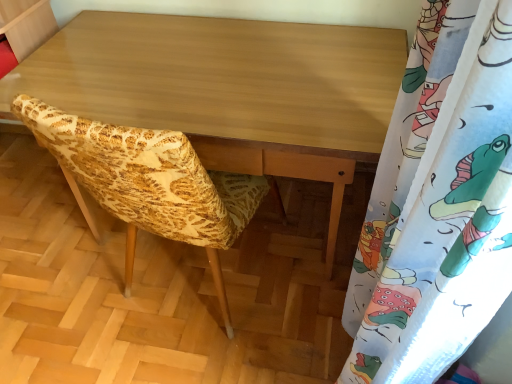
The image size is (512, 384). I want to click on white fabric with colorful cartoon print at right, so click(x=438, y=202).

Is light brown wood desk at center inside the boundaries of yellow fabric chair at center, or outside?

light brown wood desk at center is not inside yellow fabric chair at center, it's outside.

Is point (55, 58) closer to viewer compared to point (153, 148)?

That is False.

Which of these two, light brown wood desk at center or yellow fabric chair at center, is smaller?

With smaller size is yellow fabric chair at center.

Considering their positions, is light brown wood desk at center located in front of or behind yellow fabric chair at center?

light brown wood desk at center is in front of yellow fabric chair at center.

Is white fabric with colorful cartoon print at right taller than yellow fabric chair at center?

Correct, white fabric with colorful cartoon print at right is much taller as yellow fabric chair at center.

Looking at this image, from a real-world perspective, between white fabric with colorful cartoon print at right and yellow fabric chair at center, who is vertically lower?

From a 3D spatial view, yellow fabric chair at center is below.

Is white fabric with colorful cartoon print at right aimed at yellow fabric chair at center?

Yes.

Is yellow fabric chair at center located within white fabric with colorful cartoon print at right?

No, yellow fabric chair at center is not surrounded by white fabric with colorful cartoon print at right.

Which of these two, yellow fabric chair at center or light brown wood desk at center, stands shorter?

yellow fabric chair at center.

Consider the image. From a real-world perspective, which object rests below the other?

From a 3D spatial view, yellow fabric chair at center is below.

Does point (70, 167) appear closer or farther from the camera than point (312, 139)?

Point (70, 167) is positioned farther from the camera compared to point (312, 139).

Considering the relative positions of yellow fabric chair at center and white fabric with colorful cartoon print at right in the image provided, is yellow fabric chair at center behind white fabric with colorful cartoon print at right?

Yes, it is behind white fabric with colorful cartoon print at right.

Measure the distance from yellow fabric chair at center to white fabric with colorful cartoon print at right.

yellow fabric chair at center and white fabric with colorful cartoon print at right are 18.23 inches apart.

Do you think yellow fabric chair at center is within white fabric with colorful cartoon print at right, or outside of it?

yellow fabric chair at center exists outside the volume of white fabric with colorful cartoon print at right.

Considering the relative sizes of yellow fabric chair at center and white fabric with colorful cartoon print at right in the image provided, is yellow fabric chair at center bigger than white fabric with colorful cartoon print at right?

Yes, yellow fabric chair at center is bigger than white fabric with colorful cartoon print at right.

Which is nearer, (481, 96) or (77, 85)?

The point (481, 96) is closer.

Which is more to the left, white fabric with colorful cartoon print at right or light brown wood desk at center?

light brown wood desk at center.

Can you see white fabric with colorful cartoon print at right touching light brown wood desk at center?

No, white fabric with colorful cartoon print at right is not in contact with light brown wood desk at center.

Is white fabric with colorful cartoon print at right oriented away from light brown wood desk at center?

white fabric with colorful cartoon print at right does not have its back to light brown wood desk at center.

Does light brown wood desk at center turn towards white fabric with colorful cartoon print at right?

Yes, light brown wood desk at center is turned towards white fabric with colorful cartoon print at right.

The image size is (512, 384). In order to click on curtain in front of the light brown wood desk at center in this screenshot , I will do `click(438, 202)`.

Which of these two, light brown wood desk at center or white fabric with colorful cartoon print at right, is bigger?

light brown wood desk at center.

Are light brown wood desk at center and white fabric with colorful cartoon print at right beside each other?

light brown wood desk at center and white fabric with colorful cartoon print at right are clearly separated.

Find the location of a particular element. furniture below the light brown wood desk at center (from the image's perspective) is located at coordinates (149, 182).

Locate an element on the screen. This screenshot has width=512, height=384. curtain on the right of yellow fabric chair at center is located at coordinates (438, 202).

Considering their positions, is white fabric with colorful cartoon print at right positioned further to light brown wood desk at center than yellow fabric chair at center?

Among the two, white fabric with colorful cartoon print at right is located further to light brown wood desk at center.

Which object lies nearer to the anchor point yellow fabric chair at center, white fabric with colorful cartoon print at right or light brown wood desk at center?

The object closer to yellow fabric chair at center is light brown wood desk at center.

Looking at the image, which one is located further to light brown wood desk at center, yellow fabric chair at center or white fabric with colorful cartoon print at right?

Based on the image, white fabric with colorful cartoon print at right appears to be further to light brown wood desk at center.

In the scene shown: Which object lies further to the anchor point yellow fabric chair at center, light brown wood desk at center or white fabric with colorful cartoon print at right?

white fabric with colorful cartoon print at right is further to yellow fabric chair at center.

Estimate the real-world distances between objects in this image. Which object is closer to white fabric with colorful cartoon print at right, light brown wood desk at center or yellow fabric chair at center?

yellow fabric chair at center.

Looking at the image, which one is located further to white fabric with colorful cartoon print at right, yellow fabric chair at center or light brown wood desk at center?

light brown wood desk at center is further to white fabric with colorful cartoon print at right.

Find the location of a particular element. The height and width of the screenshot is (384, 512). desk between yellow fabric chair at center and white fabric with colorful cartoon print at right from left to right is located at coordinates (230, 89).